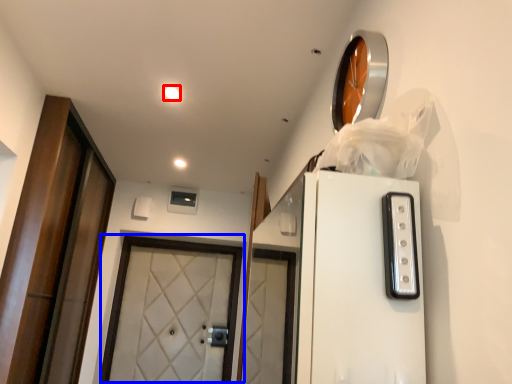
Question: Which object is closer to the camera taking this photo, lighting (highlighted by a red box) or door (highlighted by a blue box)?

Choices:
 (A) lighting
 (B) door

Answer: (A)